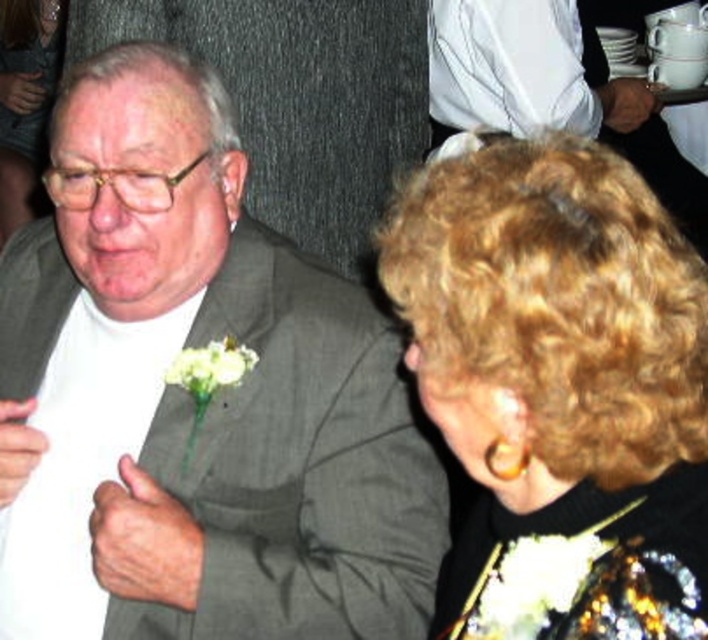
Who is more distant from viewer, [683,356] or [224,340]?

Positioned behind is point [224,340].

Is point (451, 260) closer to camera compared to point (178, 385)?

Yes.

At what (x,y) coordinates should I click in order to perform the action: click on curly hair at upper right. Please return your answer as a coordinate pair (x, y). This screenshot has width=708, height=640. Looking at the image, I should click on (559, 387).

Who is higher up, matte gray suit at center or white matte flower at center?

Positioned higher is white matte flower at center.

The width and height of the screenshot is (708, 640). What do you see at coordinates (190, 400) in the screenshot?
I see `matte gray suit at center` at bounding box center [190, 400].

Find the location of a particular element. matte gray suit at center is located at coordinates (190, 400).

Is curly hair at upper right wider than shiny gold necklace at upper center?

No, curly hair at upper right is not wider than shiny gold necklace at upper center.

Image resolution: width=708 pixels, height=640 pixels. I want to click on curly hair at upper right, so click(x=559, y=387).

Measure the distance between curly hair at upper right and camera.

They are 28.77 inches apart.

Where is `curly hair at upper right`? This screenshot has width=708, height=640. curly hair at upper right is located at coordinates (559, 387).